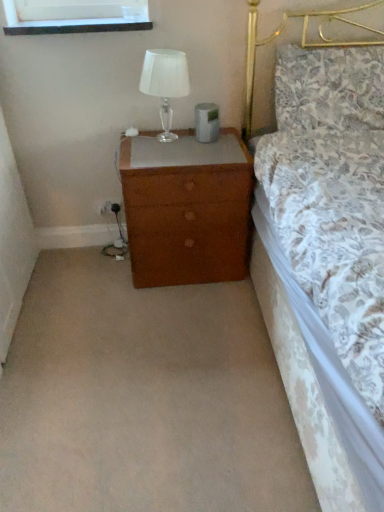
Where is `vacant space underneath clear glass table lamp at upper right (from a real-world perspective)`? vacant space underneath clear glass table lamp at upper right (from a real-world perspective) is located at coordinates (161, 134).